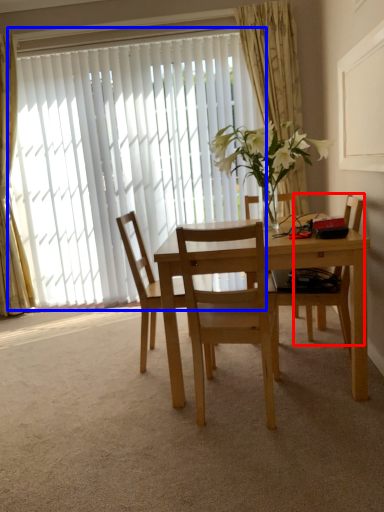
Question: Which object appears closest to the camera in this image, chair (highlighted by a red box) or window (highlighted by a blue box)?

Choices:
 (A) chair
 (B) window

Answer: (A)